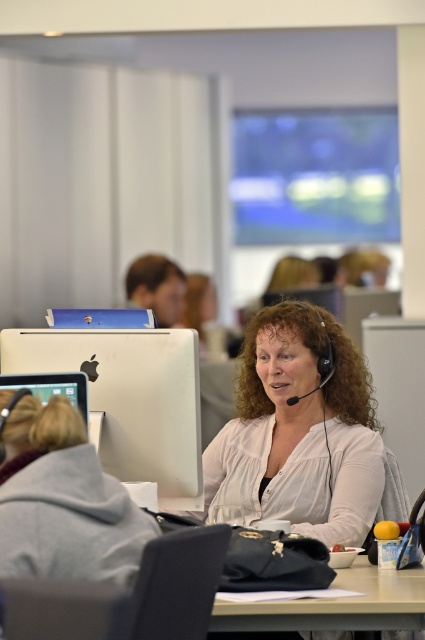
Question: Which point is closer to the camera?

Choices:
 (A) (283, 301)
 (B) (50, 448)
 (C) (248, 612)

Answer: (B)

Question: Which of the following is the farthest from the observer?

Choices:
 (A) matte gray laptop at left
 (B) matte black monitor at lower left

Answer: (B)

Question: Is white matte shirt at center below matte black monitor at lower left?

Choices:
 (A) yes
 (B) no

Answer: (A)

Question: Which of these objects is positioned closest to the matte gray laptop at left?

Choices:
 (A) white matte shirt at center
 (B) smooth white table at center
 (C) gray hoodie at lower left
 (D) white matte computer at left

Answer: (C)

Question: Can you confirm if white matte shirt at center is smaller than white matte computer at left?

Choices:
 (A) yes
 (B) no

Answer: (B)

Question: Is matte gray laptop at left bigger than matte black monitor at lower left?

Choices:
 (A) yes
 (B) no

Answer: (A)